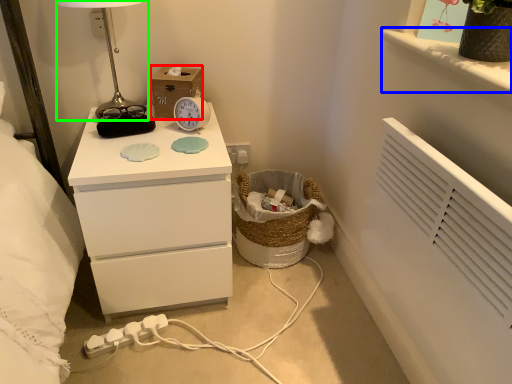
Question: Estimate the real-world distances between objects in this image. Which object is closer to cardboard box (highlighted by a red box), window sill (highlighted by a blue box) or table lamp (highlighted by a green box)?

Choices:
 (A) window sill
 (B) table lamp

Answer: (B)